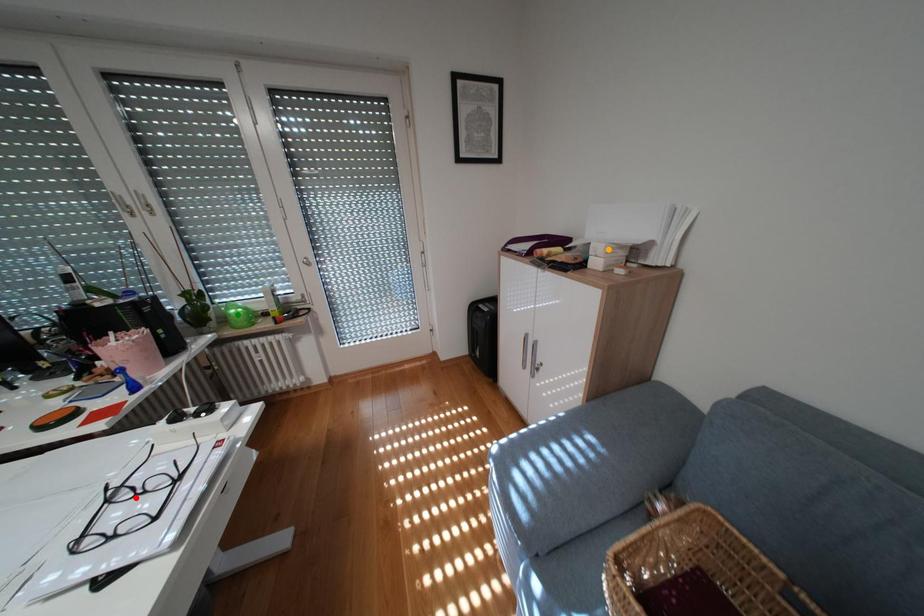
Order these from farthest to nearest:
orange point, green point, red point

1. green point
2. orange point
3. red point